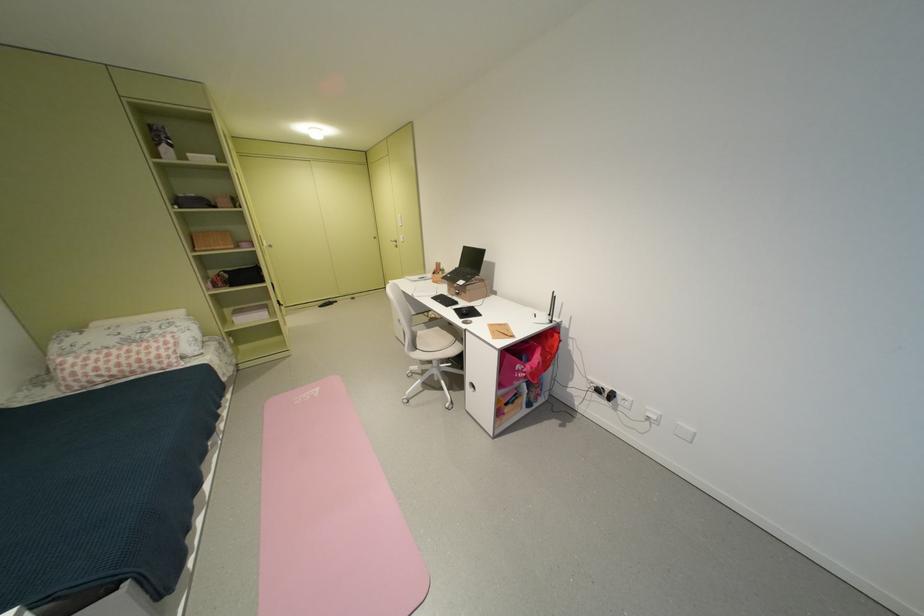
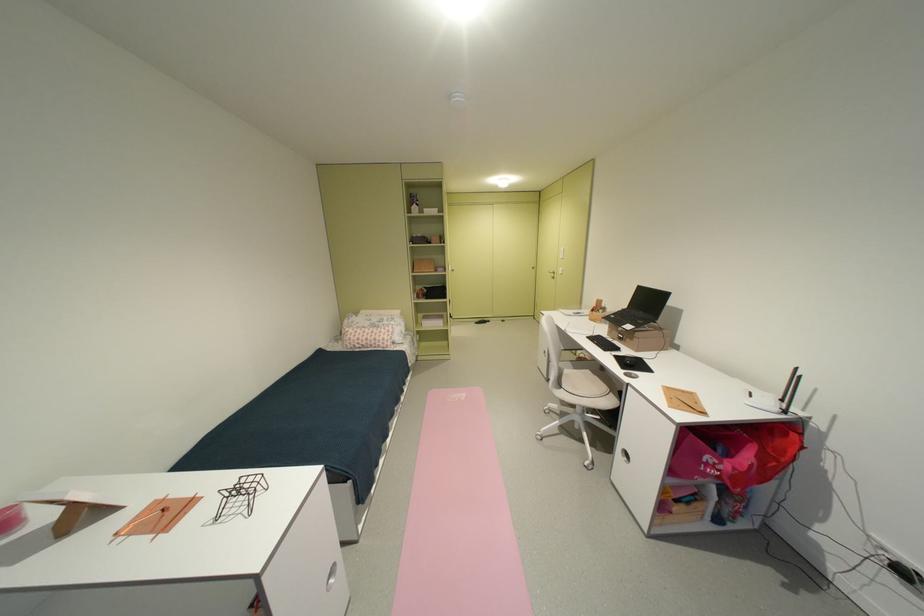
Question: The first image is from the beginning of the video and the second image is from the end. How did the camera likely rotate when shooting the video?

Choices:
 (A) Left
 (B) Right
 (C) Up
 (D) Down

Answer: (A)